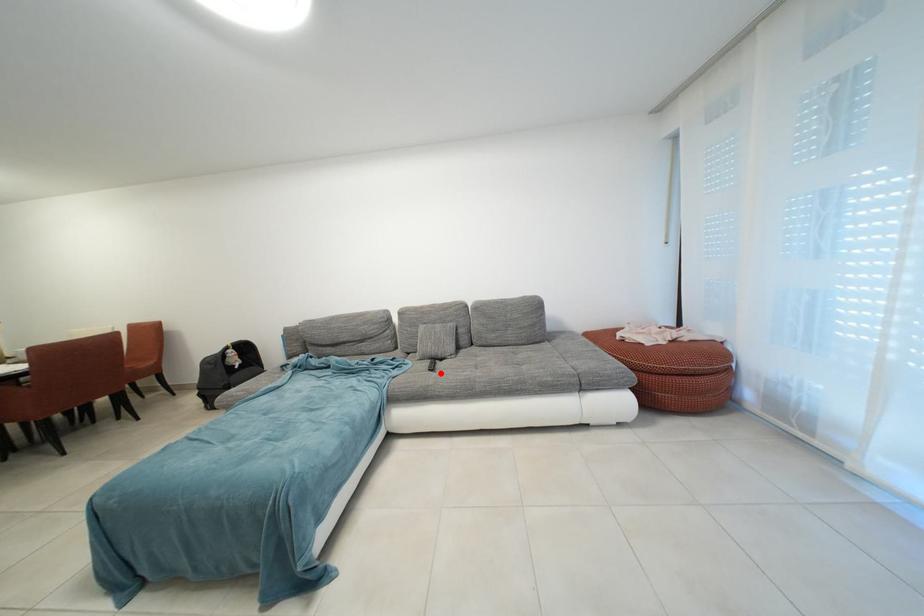
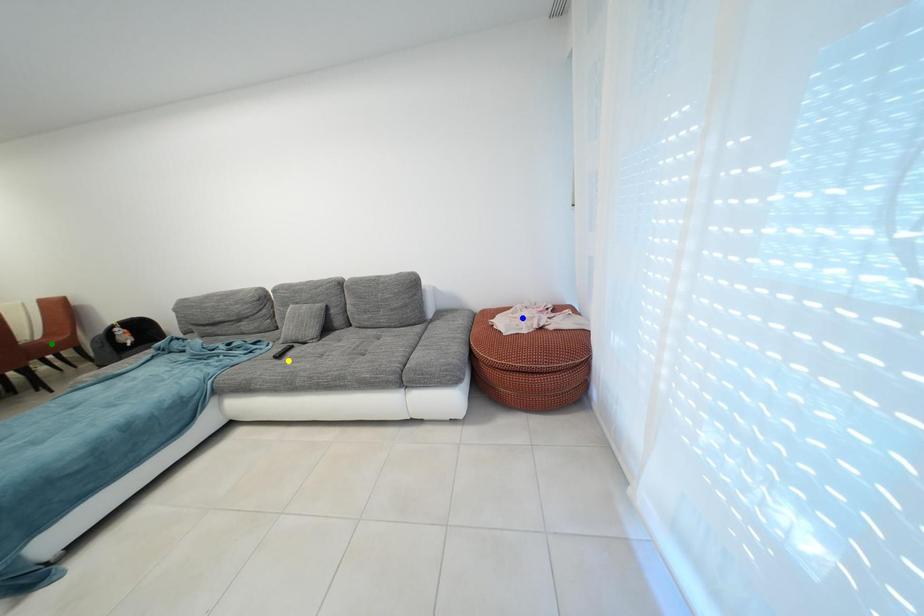
Question: I am providing you with two images of the same scene from different viewpoints. A red point is marked on the first image. You are given multiple points on the second image. Which point in image 2 is actually the same real-world point as the red point in image 1?

Choices:
 (A) yellow point
 (B) green point
 (C) blue point

Answer: (A)